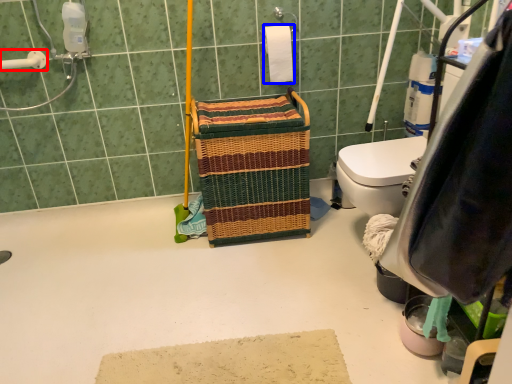
Question: Which object appears closest to the camera in this image, shower (highlighted by a red box) or toilet paper (highlighted by a blue box)?

Choices:
 (A) shower
 (B) toilet paper

Answer: (A)